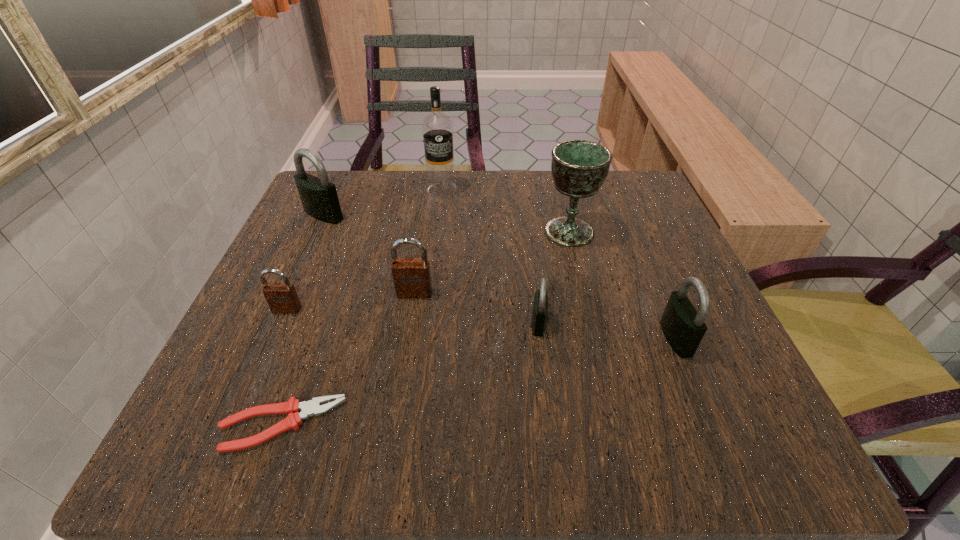
Where is `padlock that is the fourth nearest to the third tallest object`? This screenshot has width=960, height=540. padlock that is the fourth nearest to the third tallest object is located at coordinates (683, 326).

Where is `padlock identified as the closest to the fourth farthest object`? This screenshot has width=960, height=540. padlock identified as the closest to the fourth farthest object is located at coordinates (282, 298).

Locate which black padlock ranks second in proximity to the tallest object. Please provide its 2D coordinates. Your answer should be formatted as a tuple, i.e. [(x, y)], where the tuple contains the x and y coordinates of a point satisfying the conditions above.

[(540, 304)]

Where is `black padlock that is the third closest to the left brown padlock`? black padlock that is the third closest to the left brown padlock is located at coordinates (683, 326).

Identify the location of free spot that satisfies the following two spatial constraints: 1. on the front-facing side of the left brown padlock; 2. on the left side of the rightmost object. This screenshot has width=960, height=540. (275, 339).

I want to click on vacant region that satisfies the following two spatial constraints: 1. on the front-facing side of the fourth farthest object; 2. on the right side of the third object from right to left, so click(x=410, y=323).

Image resolution: width=960 pixels, height=540 pixels. Find the location of `blank area in the image that satisfies the following two spatial constraints: 1. on the front side of the rightmost black padlock; 2. on the right side of the chalice`. blank area in the image that satisfies the following two spatial constraints: 1. on the front side of the rightmost black padlock; 2. on the right side of the chalice is located at coordinates (595, 339).

The image size is (960, 540). In order to click on vacant point that satisfies the following two spatial constraints: 1. on the front-facing side of the rightmost padlock; 2. on the left side of the nearer brown padlock in this screenshot , I will do `click(275, 339)`.

You are a GUI agent. You are given a task and a screenshot of the screen. Output one action in this format:
    pyautogui.click(x=<x>, y=<y>)
    Task: Click on the vacant space that satisfies the following two spatial constraints: 1. on the front side of the rightmost padlock; 2. on the left side of the leftmost black padlock
    
    Given the screenshot: What is the action you would take?
    pyautogui.click(x=268, y=339)